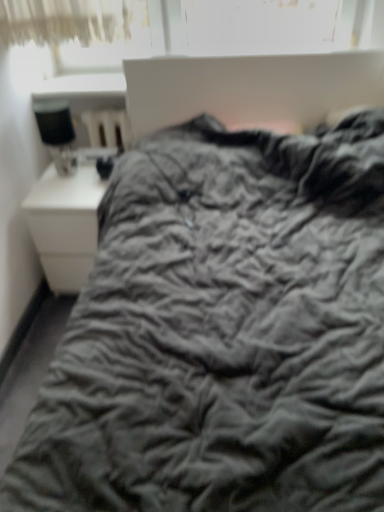
Question: Is point pyautogui.click(x=61, y=240) closer or farther from the camera than point pyautogui.click(x=74, y=159)?

Choices:
 (A) closer
 (B) farther

Answer: (A)

Question: From the image's perspective, is white glossy nightstand at left above or below matte black lamp at left?

Choices:
 (A) below
 (B) above

Answer: (A)

Question: In terms of height, does white glossy nightstand at left look taller or shorter compared to matte black lamp at left?

Choices:
 (A) short
 (B) tall

Answer: (B)

Question: Is matte black lamp at left taller or shorter than white glossy nightstand at left?

Choices:
 (A) short
 (B) tall

Answer: (A)

Question: Do you think matte black lamp at left is within white glossy nightstand at left, or outside of it?

Choices:
 (A) outside
 (B) inside

Answer: (A)

Question: Would you say matte black lamp at left is to the left or to the right of white glossy nightstand at left in the picture?

Choices:
 (A) right
 (B) left

Answer: (B)

Question: Relative to white glossy nightstand at left, is matte black lamp at left in front or behind?

Choices:
 (A) behind
 (B) front

Answer: (B)